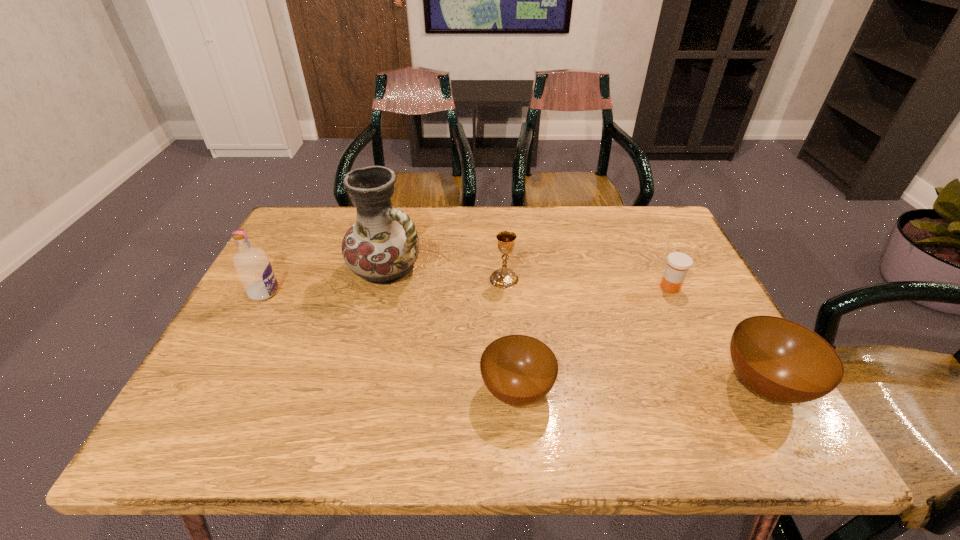
Find the location of a particular element. The width and height of the screenshot is (960, 540). vacant area in the image that satisfies the following two spatial constraints: 1. on the label of the right bowl; 2. on the right side of the vodka is located at coordinates (214, 384).